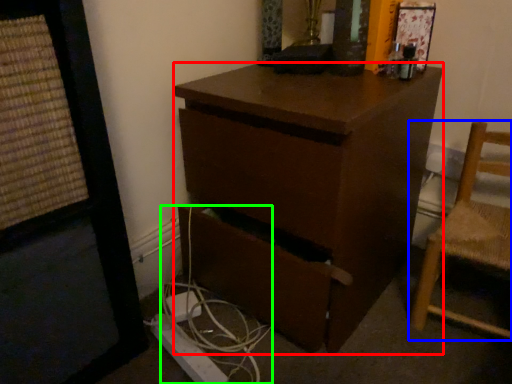
Question: Which is nearer to the desk (highlighted by a red box)? chair (highlighted by a blue box) or cable (highlighted by a green box).

Choices:
 (A) chair
 (B) cable

Answer: (B)